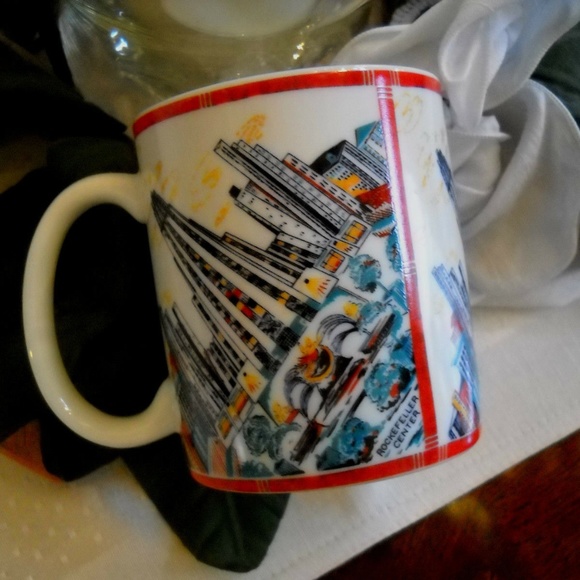
Image resolution: width=580 pixels, height=580 pixels. Identify the location of upper rim of cup. (296, 71).